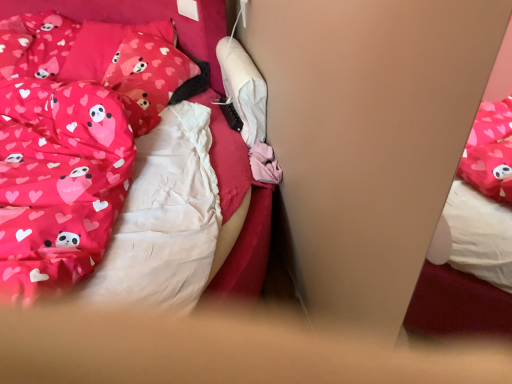
The image size is (512, 384). Find the location of `pink satin bed at center`. pink satin bed at center is located at coordinates (122, 172).

Where is `pink satin bed at center`? This screenshot has width=512, height=384. pink satin bed at center is located at coordinates (122, 172).

Is point (182, 60) closer or farther from the camera than point (165, 86)?

Clearly, point (182, 60) is more distant from the camera than point (165, 86).

Considering their positions, is matte pink fabric pillow at upper left, arranged as the first pillow when viewed from the front, located in front of or behind pink fabric pillow at upper left, acting as the 1th pillow starting from the back?

matte pink fabric pillow at upper left, arranged as the first pillow when viewed from the front, is in front of pink fabric pillow at upper left, acting as the 1th pillow starting from the back.

Can you confirm if matte pink fabric pillow at upper left, positioned as the 2th pillow in back-to-front order, is thinner than pink fabric pillow at upper left, the 2th pillow in the front-to-back sequence?

Yes, matte pink fabric pillow at upper left, positioned as the 2th pillow in back-to-front order, is thinner than pink fabric pillow at upper left, the 2th pillow in the front-to-back sequence.

Is pink fabric pillow at upper left, the 2th pillow in the front-to-back sequence, aimed at matte pink fabric pillow at upper left, arranged as the first pillow when viewed from the front?

Yes, pink fabric pillow at upper left, the 2th pillow in the front-to-back sequence, is oriented towards matte pink fabric pillow at upper left, arranged as the first pillow when viewed from the front.

Based on the photo, does pink fabric pillow at upper left, acting as the 1th pillow starting from the back, come in front of matte pink fabric pillow at upper left, arranged as the first pillow when viewed from the front?

That is False.

Identify the location of pillow below the pink fabric pillow at upper left, acting as the 1th pillow starting from the back (from a real-world perspective). The image size is (512, 384). (149, 66).

From the image's perspective, which one is positioned higher, pink fabric pillow at upper left, acting as the 1th pillow starting from the back, or matte pink fabric pillow at upper left, arranged as the first pillow when viewed from the front?

pink fabric pillow at upper left, acting as the 1th pillow starting from the back.

Consider the image. Are pink fabric pillow at upper left, the 2th pillow in the front-to-back sequence, and pink satin bed at center located far from each other?

No, pink fabric pillow at upper left, the 2th pillow in the front-to-back sequence, is not far away from pink satin bed at center.

Does point (132, 38) appear closer or farther from the camera than point (120, 25)?

Point (132, 38) is farther from the camera than point (120, 25).

Considering the positions of objects pink fabric pillow at upper left, the 2th pillow in the front-to-back sequence, and pink satin bed at center in the image provided, who is more to the right, pink fabric pillow at upper left, the 2th pillow in the front-to-back sequence, or pink satin bed at center?

pink fabric pillow at upper left, the 2th pillow in the front-to-back sequence, is more to the right.

From a real-world perspective, who is located higher, matte pink fabric pillow at upper left, positioned as the 2th pillow in back-to-front order, or pink satin bed at center?

From a 3D spatial view, matte pink fabric pillow at upper left, positioned as the 2th pillow in back-to-front order, is above.

From the image's perspective, which is above, matte pink fabric pillow at upper left, positioned as the 2th pillow in back-to-front order, or pink satin bed at center?

From the image's view, matte pink fabric pillow at upper left, positioned as the 2th pillow in back-to-front order, is above.

Which of these two, matte pink fabric pillow at upper left, arranged as the first pillow when viewed from the front, or pink satin bed at center, is smaller?

matte pink fabric pillow at upper left, arranged as the first pillow when viewed from the front.

Would you say matte pink fabric pillow at upper left, arranged as the first pillow when viewed from the front, is inside or outside pink satin bed at center?

matte pink fabric pillow at upper left, arranged as the first pillow when viewed from the front, is located beyond the bounds of pink satin bed at center.

From the image's perspective, who appears lower, pink satin bed at center or matte pink fabric pillow at upper left, arranged as the first pillow when viewed from the front?

pink satin bed at center is shown below in the image.

From the picture: Considering the sizes of objects pink satin bed at center and matte pink fabric pillow at upper left, positioned as the 2th pillow in back-to-front order, in the image provided, who is shorter, pink satin bed at center or matte pink fabric pillow at upper left, positioned as the 2th pillow in back-to-front order,?

matte pink fabric pillow at upper left, positioned as the 2th pillow in back-to-front order, is shorter.

Is pink satin bed at center positioned with its back to matte pink fabric pillow at upper left, arranged as the first pillow when viewed from the front?

pink satin bed at center does not have its back to matte pink fabric pillow at upper left, arranged as the first pillow when viewed from the front.

Is the surface of pink satin bed at center in direct contact with matte pink fabric pillow at upper left, arranged as the first pillow when viewed from the front?

No, pink satin bed at center is not next to matte pink fabric pillow at upper left, arranged as the first pillow when viewed from the front.

Does pink satin bed at center have a greater height compared to pink fabric pillow at upper left, acting as the 1th pillow starting from the back?

Yes, pink satin bed at center is taller than pink fabric pillow at upper left, acting as the 1th pillow starting from the back.

From the image's perspective, would you say pink satin bed at center is shown under pink fabric pillow at upper left, the 2th pillow in the front-to-back sequence?

Yes.

Considering the sizes of objects pink satin bed at center and pink fabric pillow at upper left, acting as the 1th pillow starting from the back, in the image provided, who is bigger, pink satin bed at center or pink fabric pillow at upper left, acting as the 1th pillow starting from the back,?

Bigger between the two is pink satin bed at center.

Is pink satin bed at center wider or thinner than pink fabric pillow at upper left, acting as the 1th pillow starting from the back?

pink satin bed at center is wider than pink fabric pillow at upper left, acting as the 1th pillow starting from the back.

I want to click on pillow below the pink fabric pillow at upper left, the 2th pillow in the front-to-back sequence (from a real-world perspective), so click(x=149, y=66).

Locate an element on the screen. The height and width of the screenshot is (384, 512). pillow lying behind the matte pink fabric pillow at upper left, positioned as the 2th pillow in back-to-front order is located at coordinates (124, 54).

From the image, which object appears to be nearer to matte pink fabric pillow at upper left, positioned as the 2th pillow in back-to-front order, pink satin bed at center or pink fabric pillow at upper left, the 2th pillow in the front-to-back sequence?

pink fabric pillow at upper left, the 2th pillow in the front-to-back sequence, is positioned closer to the anchor matte pink fabric pillow at upper left, positioned as the 2th pillow in back-to-front order.

When comparing their distances from pink satin bed at center, does matte pink fabric pillow at upper left, positioned as the 2th pillow in back-to-front order, or pink fabric pillow at upper left, acting as the 1th pillow starting from the back, seem further?

pink fabric pillow at upper left, acting as the 1th pillow starting from the back, lies further to pink satin bed at center than the other object.

When comparing their distances from pink satin bed at center, does pink fabric pillow at upper left, the 2th pillow in the front-to-back sequence, or matte pink fabric pillow at upper left, positioned as the 2th pillow in back-to-front order, seem further?

pink fabric pillow at upper left, the 2th pillow in the front-to-back sequence.

Which object lies further to the anchor point pink fabric pillow at upper left, acting as the 1th pillow starting from the back, matte pink fabric pillow at upper left, positioned as the 2th pillow in back-to-front order, or pink satin bed at center?

Among the two, pink satin bed at center is located further to pink fabric pillow at upper left, acting as the 1th pillow starting from the back.

From the image, which object appears to be farther from pink fabric pillow at upper left, acting as the 1th pillow starting from the back, pink satin bed at center or matte pink fabric pillow at upper left, positioned as the 2th pillow in back-to-front order?

Based on the image, pink satin bed at center appears to be further to pink fabric pillow at upper left, acting as the 1th pillow starting from the back.

Based on their spatial positions, is pink fabric pillow at upper left, acting as the 1th pillow starting from the back, or pink satin bed at center closer to matte pink fabric pillow at upper left, positioned as the 2th pillow in back-to-front order?

pink fabric pillow at upper left, acting as the 1th pillow starting from the back, lies closer to matte pink fabric pillow at upper left, positioned as the 2th pillow in back-to-front order, than the other object.

This screenshot has height=384, width=512. Identify the location of pillow positioned between pink satin bed at center and pink fabric pillow at upper left, acting as the 1th pillow starting from the back, from near to far. (149, 66).